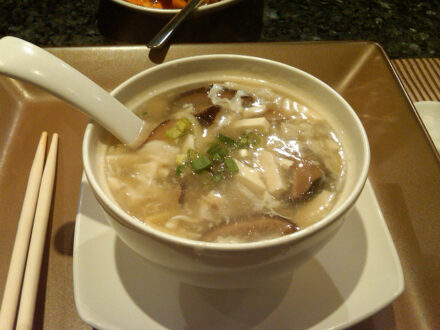
Image resolution: width=440 pixels, height=330 pixels. What are the coordinates of `kind of contents in bowl` in the screenshot? It's located at (163, 2), (178, 2).